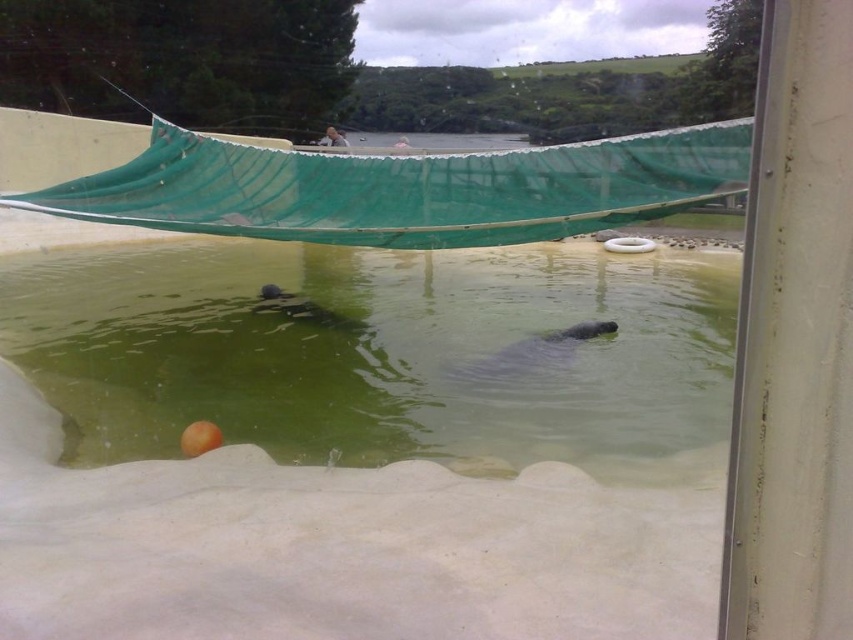
Question: Is gray matte otter at center wider than smooth gray otter at center?

Choices:
 (A) yes
 (B) no

Answer: (A)

Question: Estimate the real-world distances between objects in this image. Which object is closer to the smooth gray otter at center?

Choices:
 (A) greenish water at center
 (B) gray matte otter at center

Answer: (A)

Question: Which of the following is the closest to the observer?

Choices:
 (A) smooth gray otter at center
 (B) gray matte otter at center

Answer: (B)

Question: Which point is closer to the camera taking this photo?

Choices:
 (A) (32, 321)
 (B) (561, 349)

Answer: (B)

Question: Is greenish water at center closer to camera compared to gray matte otter at center?

Choices:
 (A) yes
 (B) no

Answer: (A)

Question: Can you confirm if greenish water at center is positioned above gray matte otter at center?

Choices:
 (A) yes
 (B) no

Answer: (A)